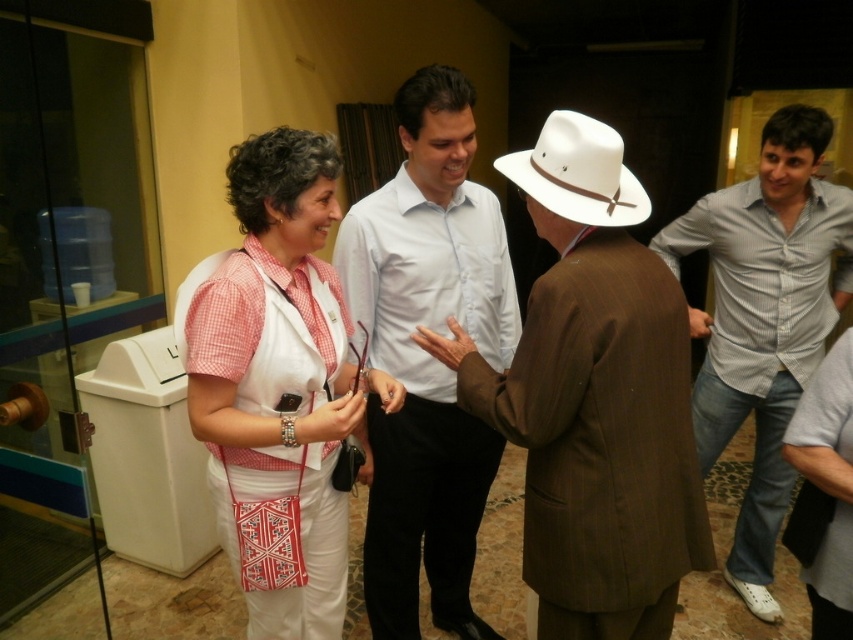
Which is in front, point (282, 451) or point (735, 244)?

Point (282, 451) is in front.

Where is `white woven vest at center`? The height and width of the screenshot is (640, 853). white woven vest at center is located at coordinates (279, 387).

Locate an element on the screen. white woven vest at center is located at coordinates (279, 387).

Does gray cotton shirt at right appear under white felt cowboy hat at center?

Yes.

Which is in front, point (828, 406) or point (595, 131)?

Positioned in front is point (595, 131).

Image resolution: width=853 pixels, height=640 pixels. What are the coordinates of `gray cotton shirt at right` in the screenshot? It's located at (827, 484).

Which is above, brown pinstripe suit at center or white woven vest at center?

Positioned higher is brown pinstripe suit at center.

The width and height of the screenshot is (853, 640). What are the coordinates of `brown pinstripe suit at center` in the screenshot? It's located at (595, 397).